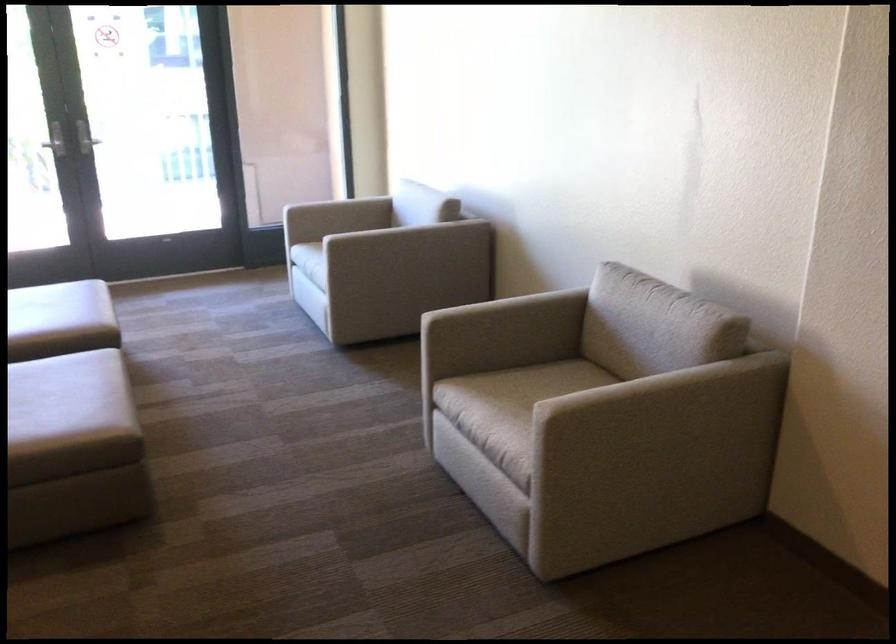
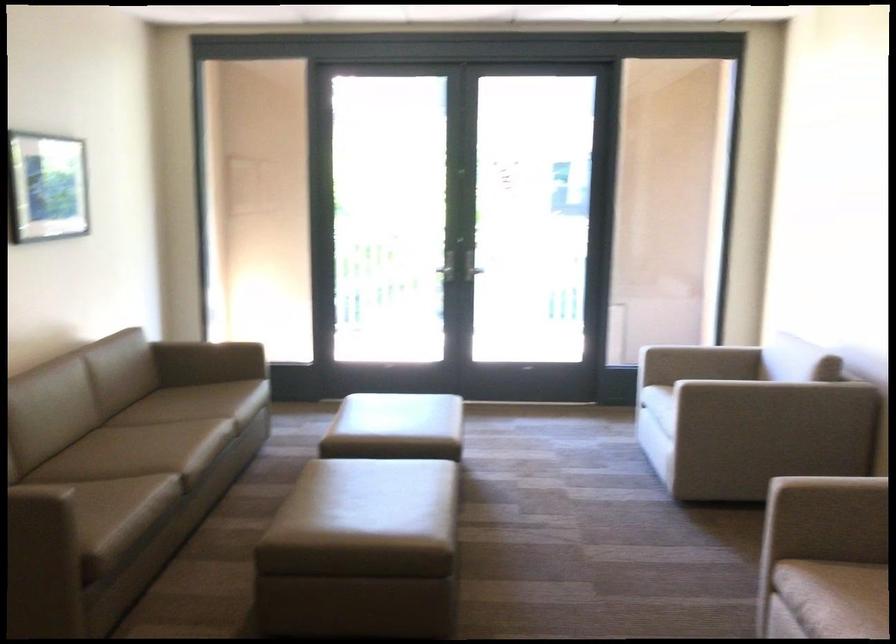
Where in the second image is the point corresponding to the point at 366,207 from the first image?

(734, 363)